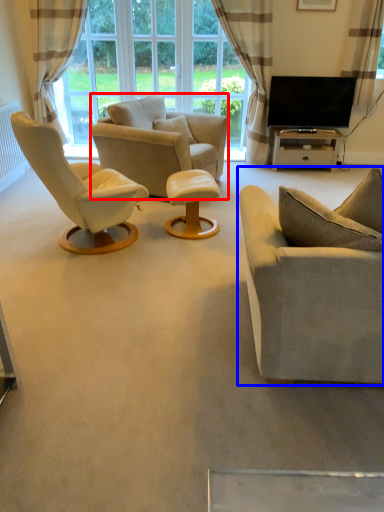
Question: Which point is closer to the camera, chair (highlighted by a red box) or studio couch (highlighted by a blue box)?

Choices:
 (A) chair
 (B) studio couch

Answer: (B)